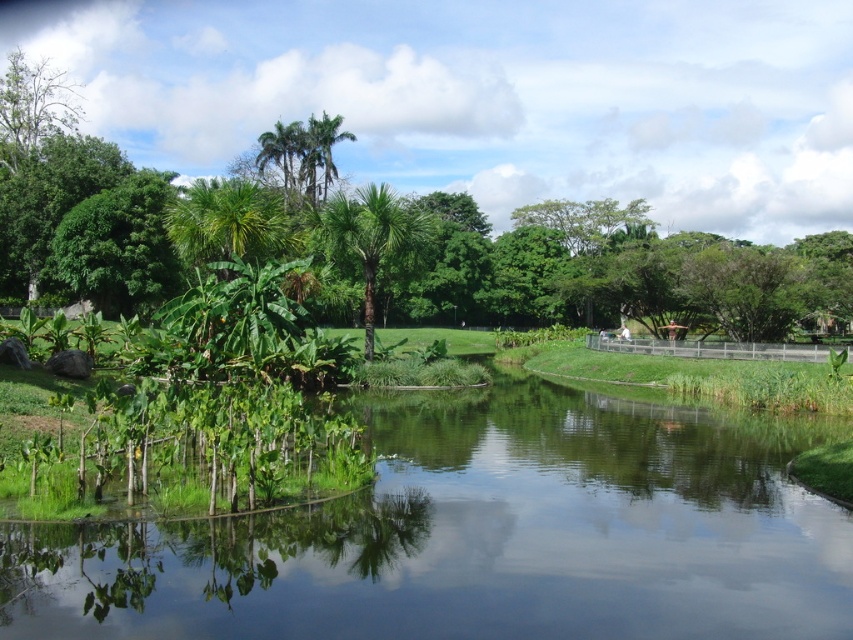
Question: Is green leafy river at center thinner than green leafy palm tree at center?

Choices:
 (A) no
 (B) yes

Answer: (A)

Question: Which object is positioned closest to the green leafy palm tree at center?

Choices:
 (A) green leafy river at center
 (B) green leafy tree at upper left

Answer: (A)

Question: Is green leafy palm tree at center closer to the viewer compared to green leafy tree at upper left?

Choices:
 (A) no
 (B) yes

Answer: (B)

Question: Which of these objects is positioned closest to the green leafy tree at upper left?

Choices:
 (A) green leafy river at center
 (B) green leafy palm tree at center

Answer: (B)

Question: Is green leafy river at center thinner than green leafy tree at upper left?

Choices:
 (A) no
 (B) yes

Answer: (B)

Question: Which point appears farthest from the camera in this image?

Choices:
 (A) (368, 195)
 (B) (415, 451)
 (C) (4, 80)

Answer: (C)